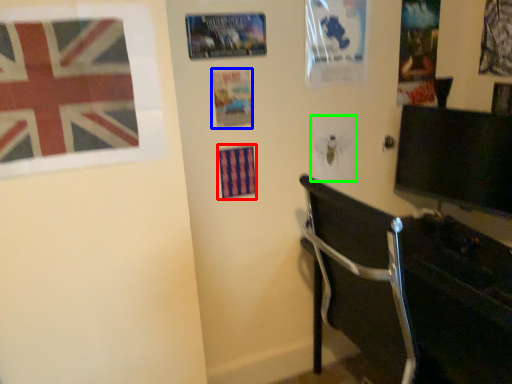
Question: Which object is the closest to the poster (highlighted by a red box)? Choose among these: poster page (highlighted by a blue box) or poster page (highlighted by a green box).

Choices:
 (A) poster page
 (B) poster page

Answer: (A)